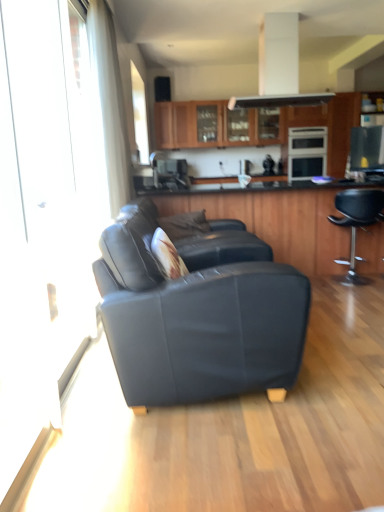
Question: From a real-world perspective, is satin black oven at center, which is the 1th appliance from top to bottom, positioned above or below wooden cabinets at upper center, placed as the second cabinetry when sorted from front to back?

Choices:
 (A) below
 (B) above

Answer: (A)

Question: Considering the positions of satin black oven at center, which is counted as the second appliance, starting from the bottom, and wooden cabinets at upper center, arranged as the second cabinetry when ordered from the bottom, in the image, is satin black oven at center, which is counted as the second appliance, starting from the bottom, taller or shorter than wooden cabinets at upper center, arranged as the second cabinetry when ordered from the bottom,?

Choices:
 (A) tall
 (B) short

Answer: (A)

Question: Which of these objects is positioned farthest from the wooden cabinet at center, which is the 1th cabinetry from front to back?

Choices:
 (A) transparent glass screen door at left
 (B) black leather stool at right
 (C) satin black microwave at upper right, which appears as the first appliance when ordered from the bottom
 (D) satin black oven at center, the 1th appliance positioned from the back
 (E) wooden cabinets at upper center, arranged as the second cabinetry when ordered from the bottom

Answer: (A)

Question: Considering the real-world distances, which object is farthest from the wooden cabinet at center, placed as the second cabinetry when sorted from back to front?

Choices:
 (A) transparent glass screen door at left
 (B) wooden cabinets at upper center, placed as the second cabinetry when sorted from front to back
 (C) matte black couch at center
 (D) black leather stool at right
 (E) satin black microwave at upper right, arranged as the 2th appliance when viewed from the back

Answer: (A)